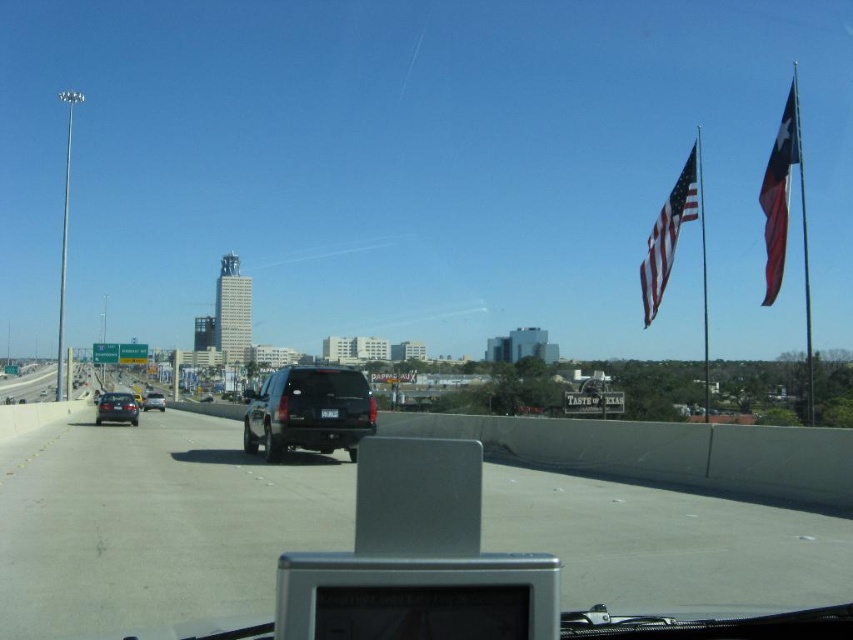
Question: Is black matte suv at center smaller than red fabric flag at right?

Choices:
 (A) yes
 (B) no

Answer: (A)

Question: Which is farther from the red fabric flag at right?

Choices:
 (A) black asphalt highway at left
 (B) black matte sedan at left
 (C) black asphalt highway at center

Answer: (A)

Question: Does transparent glass windshield at center come behind red fabric flag at right?

Choices:
 (A) yes
 (B) no

Answer: (B)

Question: Can you confirm if black matte suv at center is positioned to the left of shiny black sedan at left?

Choices:
 (A) yes
 (B) no

Answer: (B)

Question: Which point is closer to the camera taking this photo?

Choices:
 (A) (302, 404)
 (B) (712, 566)

Answer: (B)

Question: Which object is farther from the camera taking this photo?

Choices:
 (A) black asphalt highway at center
 (B) shiny black sedan at left

Answer: (B)